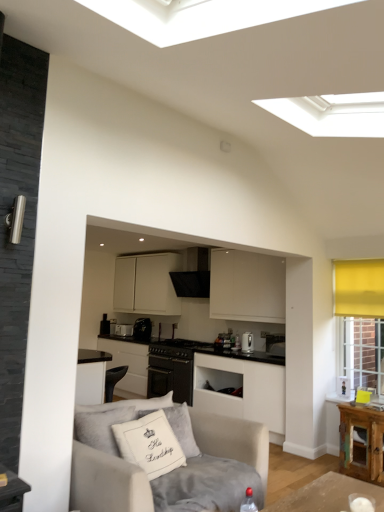
Question: From a real-world perspective, does black textured exhaust hood at center stand above satin silver kettle at center, the 1th appliance when ordered from front to back?

Choices:
 (A) no
 (B) yes

Answer: (B)

Question: Does black textured exhaust hood at center have a smaller size compared to satin silver kettle at center, which is counted as the 1th appliance, starting from the right?

Choices:
 (A) yes
 (B) no

Answer: (B)

Question: Is black textured exhaust hood at center surrounding satin silver kettle at center, the 1th appliance when ordered from front to back?

Choices:
 (A) no
 (B) yes

Answer: (A)

Question: From the image's perspective, is black textured exhaust hood at center located beneath satin silver kettle at center, marked as the 4th appliance in a back-to-front arrangement?

Choices:
 (A) yes
 (B) no

Answer: (B)

Question: Can you confirm if black textured exhaust hood at center is shorter than satin silver kettle at center, marked as the 4th appliance in a back-to-front arrangement?

Choices:
 (A) yes
 (B) no

Answer: (B)

Question: From the image's perspective, does black textured exhaust hood at center appear higher than satin silver kettle at center, which is counted as the 1th appliance, starting from the right?

Choices:
 (A) yes
 (B) no

Answer: (A)

Question: Is black textured exhaust hood at center bigger than light gray fabric couch at lower left?

Choices:
 (A) yes
 (B) no

Answer: (B)

Question: Is black textured exhaust hood at center looking in the opposite direction of light gray fabric couch at lower left?

Choices:
 (A) no
 (B) yes

Answer: (A)

Question: Does black textured exhaust hood at center have a lesser width compared to light gray fabric couch at lower left?

Choices:
 (A) yes
 (B) no

Answer: (A)

Question: Is black textured exhaust hood at center positioned far away from light gray fabric couch at lower left?

Choices:
 (A) yes
 (B) no

Answer: (A)

Question: Is black textured exhaust hood at center smaller than light gray fabric couch at lower left?

Choices:
 (A) no
 (B) yes

Answer: (B)

Question: Considering the relative sizes of black textured exhaust hood at center and light gray fabric couch at lower left in the image provided, is black textured exhaust hood at center taller than light gray fabric couch at lower left?

Choices:
 (A) no
 (B) yes

Answer: (A)

Question: From a real-world perspective, does black matte stove at center, the second appliance when ordered from front to back, sit lower than black leather armchair at lower center?

Choices:
 (A) yes
 (B) no

Answer: (B)